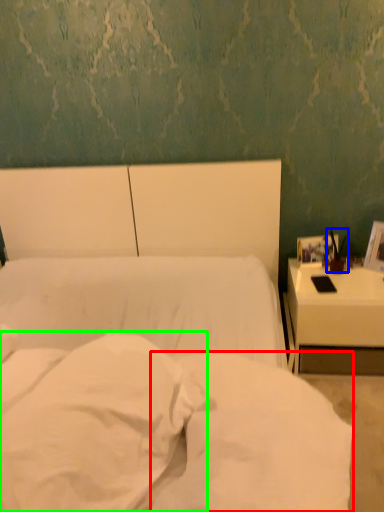
Question: Which is nearer to the sheet (highlighted by a red box)? bedside lamp (highlighted by a blue box) or pillow (highlighted by a green box).

Choices:
 (A) bedside lamp
 (B) pillow

Answer: (B)